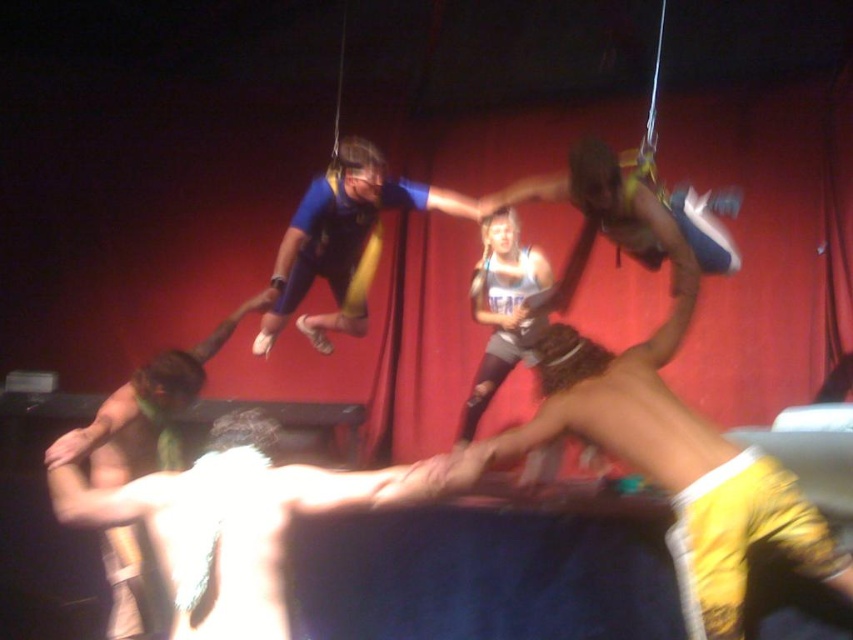
Where is the skinny white man at center located in the image?

The skinny white man at center is located at point 0.812 on the x axis and 0.285 on the y axis.

Based on the scene description, which object is larger in size between the skinny white man at center and the blue fabric at center?

The blue fabric at center is larger than the skinny white man at center.